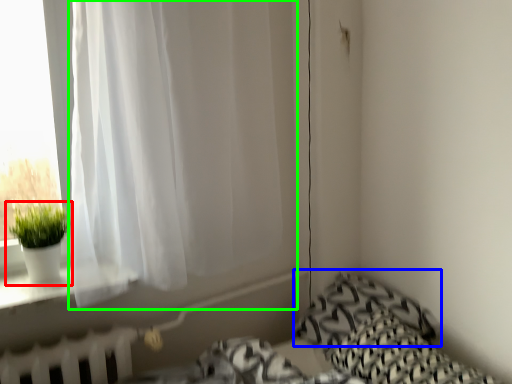
Question: Considering the real-world distances, which object is closest to houseplant (highlighted by a red box)? pillow (highlighted by a blue box) or curtain (highlighted by a green box).

Choices:
 (A) pillow
 (B) curtain

Answer: (B)